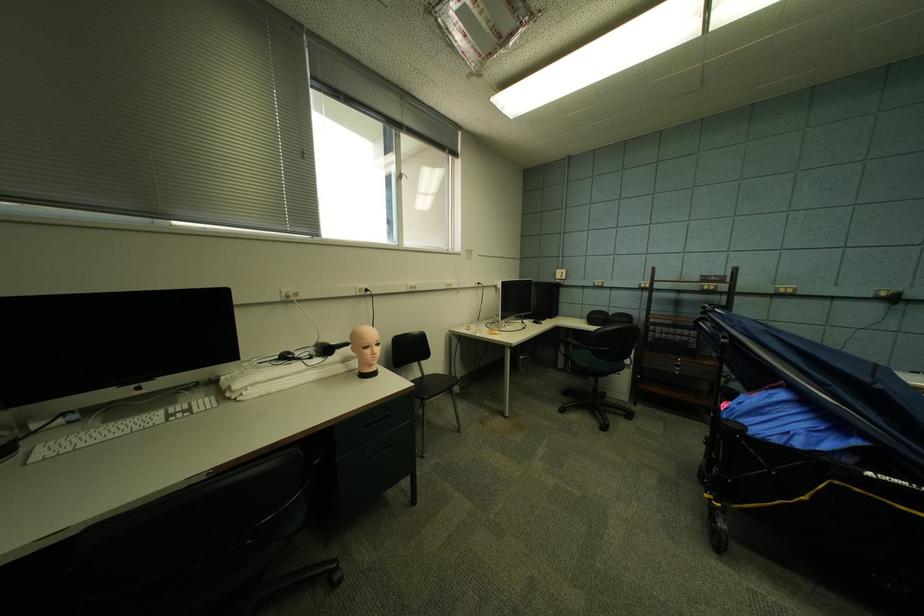
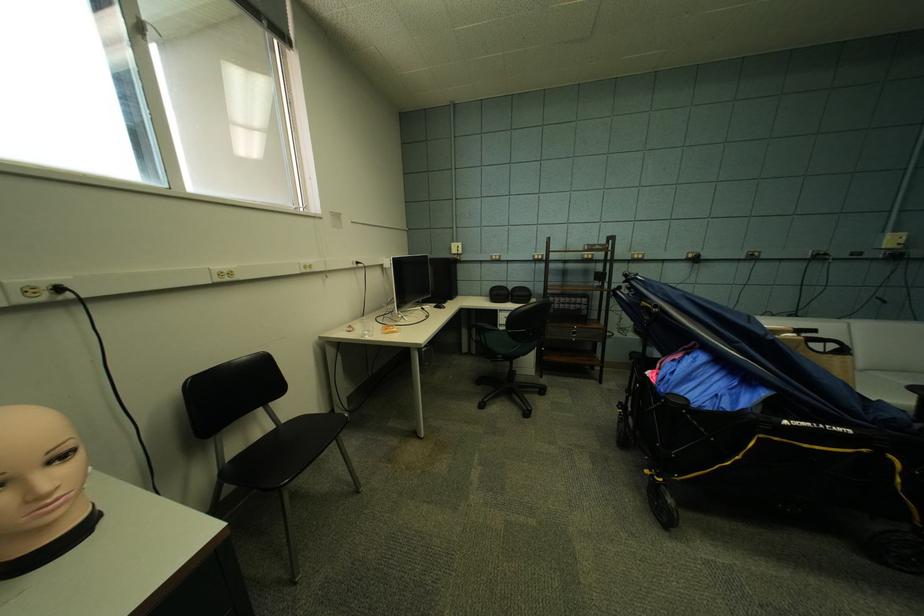
Where in the second image is the point corresponding to (x=479, y=331) from the first image?

(361, 331)